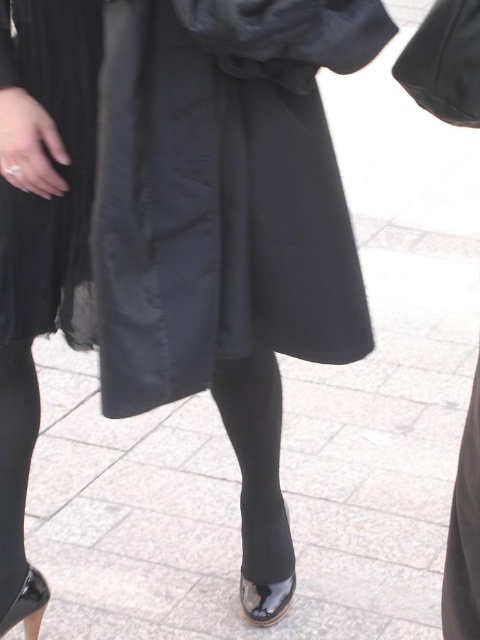
Measure the distance between matte black coat at center and matte black dress at lower left.

The distance of matte black coat at center from matte black dress at lower left is 13.20 inches.

Which of these two, matte black coat at center or matte black dress at lower left, stands taller?

With more height is matte black coat at center.

The image size is (480, 640). Find the location of `matte black coat at center`. matte black coat at center is located at coordinates (223, 192).

Which is in front, point (316, 339) or point (27, 600)?

Positioned in front is point (316, 339).

Can you confirm if matte black coat at center is thinner than glossy patent leather sandal at lower left?

No, matte black coat at center is not thinner than glossy patent leather sandal at lower left.

Locate an element on the screen. This screenshot has height=640, width=480. matte black coat at center is located at coordinates (223, 192).

Is point (268, 616) positioned behind point (24, 625)?

Yes, it is.

At what (x,y) coordinates should I click in order to perform the action: click on glossy patent leather sandal at lower center. Please return your answer as a coordinate pair (x, y). This screenshot has height=640, width=480. Looking at the image, I should click on click(265, 600).